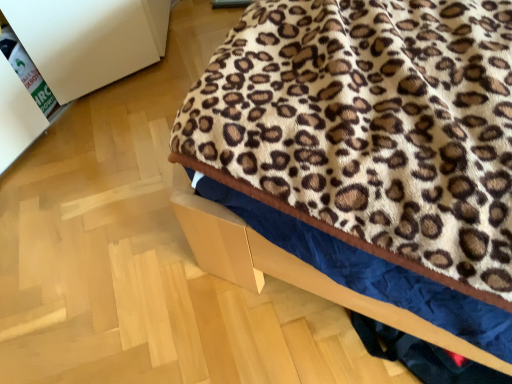
Locate an element on the screen. The width and height of the screenshot is (512, 384). free location to the left of leopard print fabric at upper right is located at coordinates (108, 232).